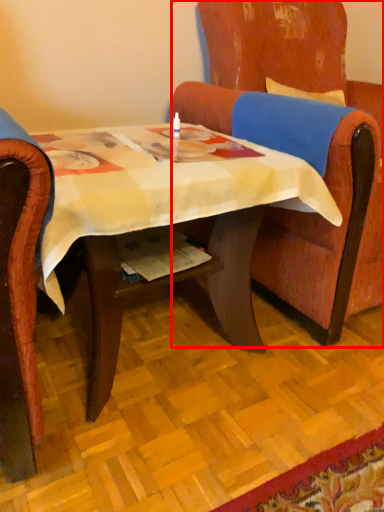
Question: From the image, what is the correct spatial relationship of chair (annotated by the red box) in relation to desk?

Choices:
 (A) right
 (B) left

Answer: (A)